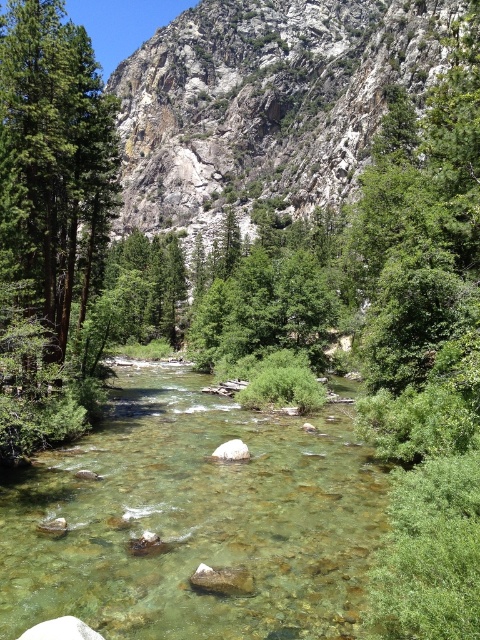
Which of these two, clear glass river at center or green matte tree at left, stands taller?

Standing taller between the two is green matte tree at left.

How far apart are clear glass river at center and green matte tree at left?

clear glass river at center and green matte tree at left are 71.12 feet apart.

Describe the element at coordinates (193, 520) in the screenshot. The width and height of the screenshot is (480, 640). I see `clear glass river at center` at that location.

Where is `clear glass river at center`? The image size is (480, 640). clear glass river at center is located at coordinates (193, 520).